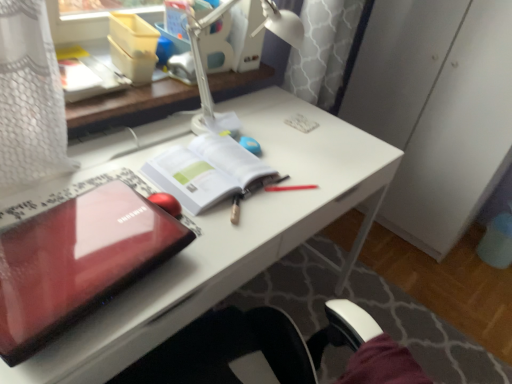
Question: Is white plastic lamp at upper center closer to camera compared to glossy plastic laptop at center-left?

Choices:
 (A) yes
 (B) no

Answer: (B)

Question: Is white plastic lamp at upper center at the left side of glossy plastic laptop at center-left?

Choices:
 (A) yes
 (B) no

Answer: (B)

Question: Is white plastic lamp at upper center far away from glossy plastic laptop at center-left?

Choices:
 (A) no
 (B) yes

Answer: (A)

Question: Considering the relative sizes of white plastic lamp at upper center and glossy plastic laptop at center-left in the image provided, is white plastic lamp at upper center wider than glossy plastic laptop at center-left?

Choices:
 (A) yes
 (B) no

Answer: (B)

Question: From the image's perspective, would you say white plastic lamp at upper center is positioned over glossy plastic laptop at center-left?

Choices:
 (A) no
 (B) yes

Answer: (B)

Question: From a real-world perspective, is white plastic lamp at upper center located higher than glossy plastic laptop at center-left?

Choices:
 (A) no
 (B) yes

Answer: (B)

Question: Does glossy plastic laptop at center-left turn towards white paper at center?

Choices:
 (A) yes
 (B) no

Answer: (B)

Question: Is white paper at center at the back of glossy plastic laptop at center-left?

Choices:
 (A) no
 (B) yes

Answer: (A)

Question: From the image's perspective, is glossy plastic laptop at center-left beneath white paper at center?

Choices:
 (A) no
 (B) yes

Answer: (B)

Question: Is glossy plastic laptop at center-left bigger than white paper at center?

Choices:
 (A) yes
 (B) no

Answer: (A)

Question: Can we say glossy plastic laptop at center-left lies outside white paper at center?

Choices:
 (A) no
 (B) yes

Answer: (B)

Question: Is glossy plastic laptop at center-left thinner than white paper at center?

Choices:
 (A) no
 (B) yes

Answer: (A)

Question: Does white paper at center have a greater width compared to glossy plastic laptop at left?

Choices:
 (A) no
 (B) yes

Answer: (A)